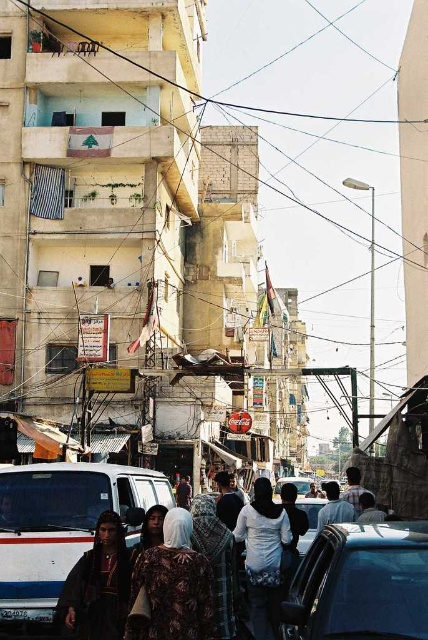
You are a delivery person needing to park your shiny black car at center in a parking spot located at coordinates 0.9, 0.8. Will the car be able to park there?

The shiny black car at center is positioned at point (360, 584), which is very close to the parking spot at (342, 576). However, the exact distance between them isn

You are a photographer standing on the bustling urban street scene. You notice a floral fabric dress at center and a white fabric headscarf at center. Which clothing item is covering the other one?

The floral fabric dress at center is positioned over the white fabric headscarf at center, so the dress is covering the headscarf.